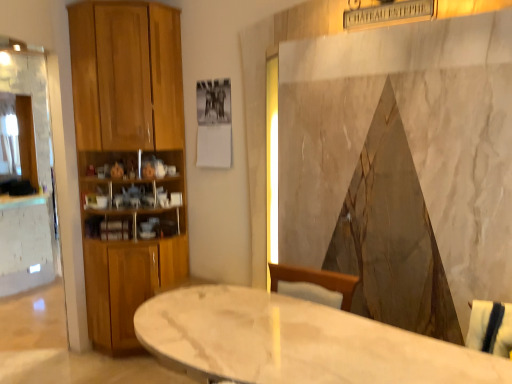
Question: Can you confirm if wooden cabinet at left is bigger than white marble table at center?

Choices:
 (A) no
 (B) yes

Answer: (B)

Question: Is wooden cabinet at left taller than white marble table at center?

Choices:
 (A) yes
 (B) no

Answer: (A)

Question: From a real-world perspective, is wooden cabinet at left located higher than white marble table at center?

Choices:
 (A) no
 (B) yes

Answer: (B)

Question: Is there a large distance between wooden cabinet at left and white marble table at center?

Choices:
 (A) yes
 (B) no

Answer: (A)

Question: Is wooden cabinet at left thinner than white marble table at center?

Choices:
 (A) yes
 (B) no

Answer: (A)

Question: Is wooden cabinet at left further to the viewer compared to white marble table at center?

Choices:
 (A) no
 (B) yes

Answer: (B)

Question: Is white marble table at center closer to camera compared to wooden cabinet at left?

Choices:
 (A) yes
 (B) no

Answer: (A)

Question: Is white marble table at center far from wooden cabinet at left?

Choices:
 (A) yes
 (B) no

Answer: (A)

Question: Is white marble table at center facing towards wooden cabinet at left?

Choices:
 (A) no
 (B) yes

Answer: (A)

Question: From a real-world perspective, is white marble table at center under wooden cabinet at left?

Choices:
 (A) yes
 (B) no

Answer: (A)

Question: From the image's perspective, does white marble table at center appear higher than wooden cabinet at left?

Choices:
 (A) no
 (B) yes

Answer: (A)

Question: Is white marble table at center next to wooden cabinet at left and touching it?

Choices:
 (A) yes
 (B) no

Answer: (B)

Question: From the image's perspective, is wooden cabinet at left above or below white marble table at center?

Choices:
 (A) below
 (B) above

Answer: (B)